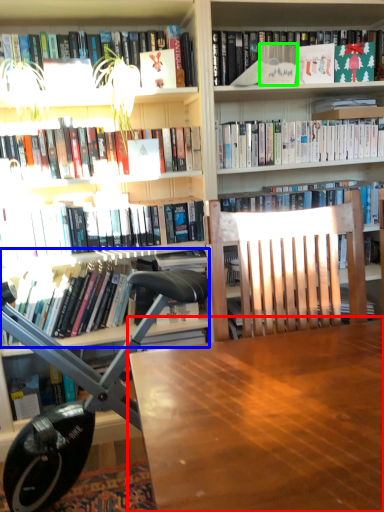
Question: Considering the real-world distances, which object is farthest from table (highlighted by a red box)? book (highlighted by a blue box) or paperback book (highlighted by a green box)?

Choices:
 (A) book
 (B) paperback book

Answer: (B)